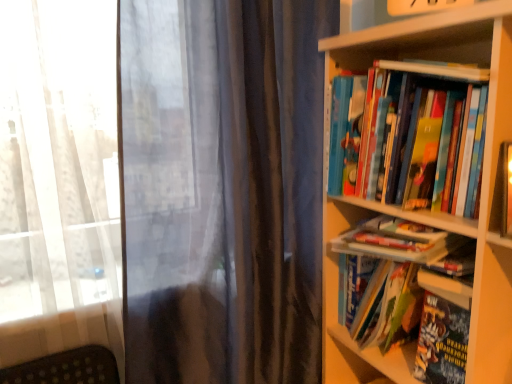
Question: Is hardcover book at center right, the 2th book viewed from the top, shorter than hardcover book at center, the 2th book ordered from the bottom?

Choices:
 (A) yes
 (B) no

Answer: (A)

Question: Considering the relative positions of hardcover book at center right, the 4th book ordered from the bottom, and hardcover book at center, the fourth book positioned from the top, in the image provided, is hardcover book at center right, the 4th book ordered from the bottom, behind hardcover book at center, the fourth book positioned from the top,?

Choices:
 (A) yes
 (B) no

Answer: (B)

Question: Considering the relative sizes of hardcover book at center right, the 4th book ordered from the bottom, and hardcover book at center, the 2th book ordered from the bottom, in the image provided, is hardcover book at center right, the 4th book ordered from the bottom, smaller than hardcover book at center, the 2th book ordered from the bottom,?

Choices:
 (A) no
 (B) yes

Answer: (B)

Question: Does hardcover book at center right, the 4th book ordered from the bottom, have a greater height compared to hardcover book at center, the 2th book ordered from the bottom?

Choices:
 (A) no
 (B) yes

Answer: (A)

Question: Is hardcover book at center, the 2th book ordered from the bottom, a part of hardcover book at center right, the 2th book viewed from the top?

Choices:
 (A) yes
 (B) no

Answer: (B)

Question: From a real-world perspective, relative to hardcover books at right, which appears as the first book when viewed from the top, is hardcover book at right, the 3th book viewed from the top, vertically above or below?

Choices:
 (A) above
 (B) below

Answer: (B)

Question: Is hardcover book at right, the 3th book viewed from the top, situated inside hardcover books at right, the 5th book in the bottom-to-top sequence, or outside?

Choices:
 (A) inside
 (B) outside

Answer: (B)

Question: Visually, is hardcover book at right, arranged as the third book when ordered from the bottom, positioned to the left or to the right of hardcover books at right, the 5th book in the bottom-to-top sequence?

Choices:
 (A) right
 (B) left

Answer: (A)

Question: In terms of size, does hardcover book at right, the 3th book viewed from the top, appear bigger or smaller than hardcover books at right, which appears as the first book when viewed from the top?

Choices:
 (A) small
 (B) big

Answer: (B)

Question: Choose the correct answer: Is hardcover book at right, which ranks as the fifth book in top-to-bottom order, inside hardcover books at right, which appears as the first book when viewed from the top, or outside it?

Choices:
 (A) outside
 (B) inside

Answer: (A)

Question: In the image, is hardcover book at right, the 1th book ordered from the bottom, on the left side or the right side of hardcover books at right, which appears as the first book when viewed from the top?

Choices:
 (A) right
 (B) left

Answer: (A)

Question: From a real-world perspective, relative to hardcover books at right, the 5th book in the bottom-to-top sequence, is hardcover book at right, the 1th book ordered from the bottom, vertically above or below?

Choices:
 (A) below
 (B) above

Answer: (A)

Question: Is hardcover book at right, the 1th book ordered from the bottom, taller or shorter than hardcover books at right, which appears as the first book when viewed from the top?

Choices:
 (A) tall
 (B) short

Answer: (B)

Question: Is point (392, 297) positioned closer to the camera than point (431, 344)?

Choices:
 (A) closer
 (B) farther

Answer: (B)

Question: From a real-world perspective, is hardcover book at center, the 2th book ordered from the bottom, above or below hardcover book at right, which ranks as the fifth book in top-to-bottom order?

Choices:
 (A) above
 (B) below

Answer: (A)